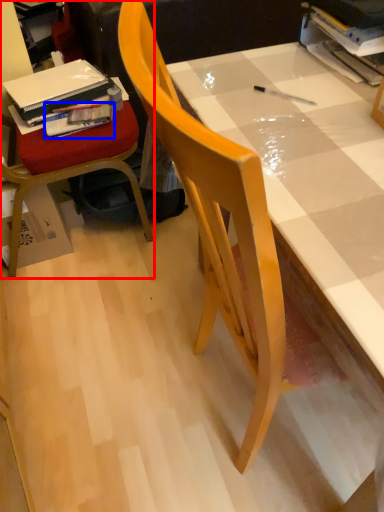
Question: Which of the following is the farthest to the observer, chair (highlighted by a red box) or book (highlighted by a blue box)?

Choices:
 (A) chair
 (B) book

Answer: (B)